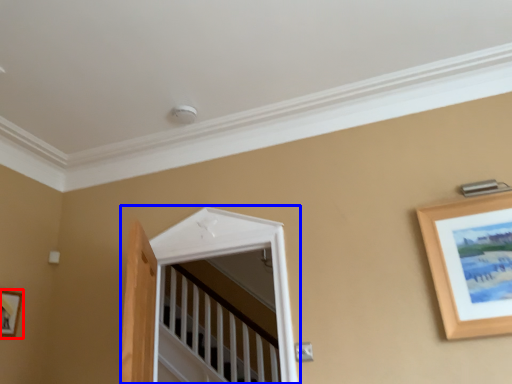
Question: Which point is closer to the camera, picture frame (highlighted by a red box) or window (highlighted by a blue box)?

Choices:
 (A) picture frame
 (B) window

Answer: (B)